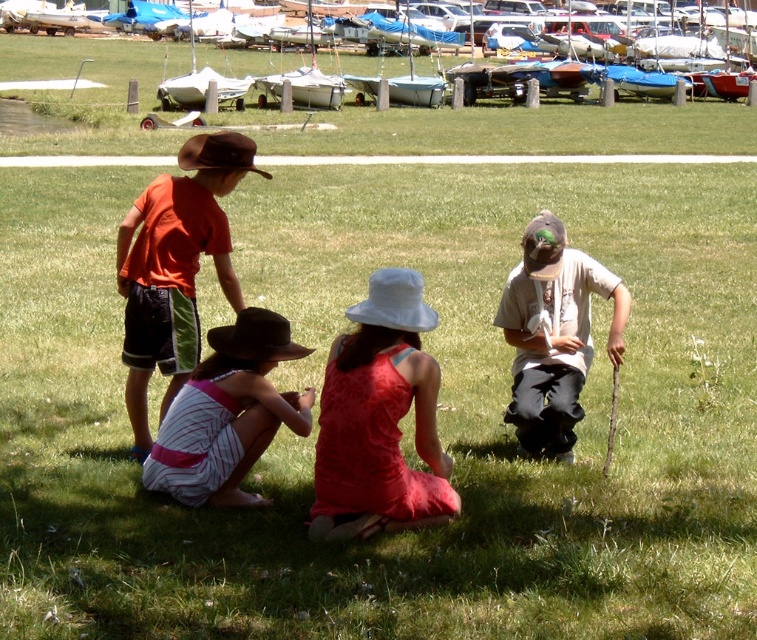
Question: Does matte red dress at center have a greater width compared to orange cotton shirt at upper left?

Choices:
 (A) yes
 (B) no

Answer: (A)

Question: Which point appears farthest from the camera in this image?

Choices:
 (A) (182, 412)
 (B) (413, 332)
 (C) (148, 364)
 (D) (513, 300)

Answer: (D)

Question: Does matte red dress at center appear on the left side of pink striped dress at center?

Choices:
 (A) no
 (B) yes

Answer: (A)

Question: Which object is positioned closest to the orange cotton shirt at upper left?

Choices:
 (A) matte red dress at center
 (B) pink striped dress at center

Answer: (B)

Question: Is pink striped dress at center positioned behind light brown cotton shirt at lower right?

Choices:
 (A) yes
 (B) no

Answer: (B)

Question: Which is nearer to the matte red dress at center?

Choices:
 (A) pink striped dress at center
 (B) orange cotton shirt at upper left

Answer: (A)